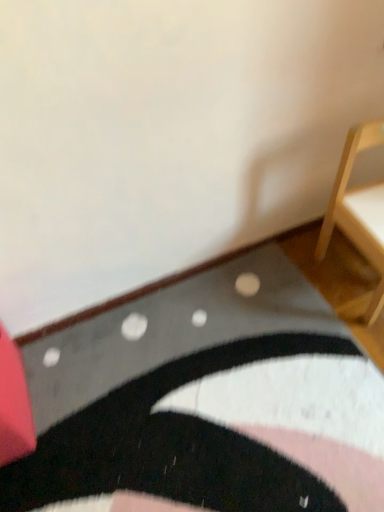
In order to face light wood chair at right, which is the 1th furniture from right to left, should I rotate leftwards or rightwards?

A 25.935 degree turn to the right will do.

The height and width of the screenshot is (512, 384). Describe the element at coordinates (14, 404) in the screenshot. I see `rubberized red cushion at lower left, which appears as the second furniture when viewed from the right` at that location.

You are a GUI agent. You are given a task and a screenshot of the screen. Output one action in this format:
    pyautogui.click(x=<x>, y=<y>)
    Task: Click on the black textured rug at lower center
    
    Given the screenshot: What is the action you would take?
    coord(206,402)

Does light wood chair at right, the 2th furniture when ordered from left to right, contain rubberized red cushion at lower left, which is counted as the first furniture, starting from the left?

Definitely not — rubberized red cushion at lower left, which is counted as the first furniture, starting from the left, is not inside light wood chair at right, the 2th furniture when ordered from left to right.

Is light wood chair at right, the 2th furniture when ordered from left to right, not near rubberized red cushion at lower left, which appears as the second furniture when viewed from the right?

They are positioned close to each other.

Is light wood chair at right, which is the 1th furniture from right to left, turned away from rubberized red cushion at lower left, which is counted as the first furniture, starting from the left?

No, rubberized red cushion at lower left, which is counted as the first furniture, starting from the left, is not at the back of light wood chair at right, which is the 1th furniture from right to left.

How far apart are light wood chair at right, which is the 1th furniture from right to left, and rubberized red cushion at lower left, which appears as the second furniture when viewed from the right?

light wood chair at right, which is the 1th furniture from right to left, is 96.89 centimeters from rubberized red cushion at lower left, which appears as the second furniture when viewed from the right.

Considering the relative sizes of rubberized red cushion at lower left, which appears as the second furniture when viewed from the right, and light wood chair at right, the 2th furniture when ordered from left to right, in the image provided, is rubberized red cushion at lower left, which appears as the second furniture when viewed from the right, bigger than light wood chair at right, the 2th furniture when ordered from left to right,?

Actually, rubberized red cushion at lower left, which appears as the second furniture when viewed from the right, might be smaller than light wood chair at right, the 2th furniture when ordered from left to right.

From the image's perspective, between rubberized red cushion at lower left, which appears as the second furniture when viewed from the right, and light wood chair at right, the 2th furniture when ordered from left to right, which one is located above?

light wood chair at right, the 2th furniture when ordered from left to right, from the image's perspective.

Would you say light wood chair at right, which is the 1th furniture from right to left, is part of rubberized red cushion at lower left, which is counted as the first furniture, starting from the left,'s contents?

No, rubberized red cushion at lower left, which is counted as the first furniture, starting from the left, does not contain light wood chair at right, which is the 1th furniture from right to left.

Can you tell me how much black textured rug at lower center and light wood chair at right, which is the 1th furniture from right to left, differ in facing direction?

89 degrees separate the facing orientations of black textured rug at lower center and light wood chair at right, which is the 1th furniture from right to left.

From a real-world perspective, is black textured rug at lower center located beneath light wood chair at right, which is the 1th furniture from right to left?

Yes, from a real-world perspective, black textured rug at lower center is below light wood chair at right, which is the 1th furniture from right to left.

Considering the positions of objects black textured rug at lower center and light wood chair at right, the 2th furniture when ordered from left to right, in the image provided, who is behind, black textured rug at lower center or light wood chair at right, the 2th furniture when ordered from left to right,?

light wood chair at right, the 2th furniture when ordered from left to right, is further away from the camera.

Consider the image. Between black textured rug at lower center and light wood chair at right, which is the 1th furniture from right to left, which one appears on the right side from the viewer's perspective?

light wood chair at right, which is the 1th furniture from right to left, is more to the right.

Considering the sizes of objects light wood chair at right, the 2th furniture when ordered from left to right, and black textured rug at lower center in the image provided, who is shorter, light wood chair at right, the 2th furniture when ordered from left to right, or black textured rug at lower center?

black textured rug at lower center.

Is light wood chair at right, the 2th furniture when ordered from left to right, positioned before black textured rug at lower center?

That is False.

Which of these two, light wood chair at right, the 2th furniture when ordered from left to right, or black textured rug at lower center, is thinner?

light wood chair at right, the 2th furniture when ordered from left to right.

From the image's perspective, is light wood chair at right, the 2th furniture when ordered from left to right, positioned above or below black textured rug at lower center?

light wood chair at right, the 2th furniture when ordered from left to right, is above black textured rug at lower center.

Image resolution: width=384 pixels, height=512 pixels. I want to click on the 1st furniture directly above the black textured rug at lower center (from a real-world perspective), so click(x=14, y=404).

From the image's perspective, is rubberized red cushion at lower left, which appears as the second furniture when viewed from the right, above black textured rug at lower center?

Correct, rubberized red cushion at lower left, which appears as the second furniture when viewed from the right, appears higher than black textured rug at lower center in the image.

Considering the positions of objects rubberized red cushion at lower left, which appears as the second furniture when viewed from the right, and black textured rug at lower center in the image provided, who is more to the left, rubberized red cushion at lower left, which appears as the second furniture when viewed from the right, or black textured rug at lower center?

Positioned to the left is rubberized red cushion at lower left, which appears as the second furniture when viewed from the right.

Considering the positions of objects black textured rug at lower center and rubberized red cushion at lower left, which is counted as the first furniture, starting from the left, in the image provided, who is more to the left, black textured rug at lower center or rubberized red cushion at lower left, which is counted as the first furniture, starting from the left,?

rubberized red cushion at lower left, which is counted as the first furniture, starting from the left.

Can you confirm if black textured rug at lower center is thinner than rubberized red cushion at lower left, which appears as the second furniture when viewed from the right?

In fact, black textured rug at lower center might be wider than rubberized red cushion at lower left, which appears as the second furniture when viewed from the right.

In the image, there is a rubberized red cushion at lower left, which appears as the second furniture when viewed from the right. Where is `mat below it (from a real-world perspective)`? Image resolution: width=384 pixels, height=512 pixels. mat below it (from a real-world perspective) is located at coordinates [x=206, y=402].

Who is bigger, black textured rug at lower center or rubberized red cushion at lower left, which is counted as the first furniture, starting from the left?

With larger size is black textured rug at lower center.

What are the coordinates of `furniture below the light wood chair at right, which is the 1th furniture from right to left (from a real-world perspective)` in the screenshot? It's located at (14, 404).

The height and width of the screenshot is (512, 384). I want to click on furniture above the rubberized red cushion at lower left, which appears as the second furniture when viewed from the right (from the image's perspective), so click(x=358, y=211).

Looking at the image, which one is located closer to light wood chair at right, the 2th furniture when ordered from left to right, black textured rug at lower center or rubberized red cushion at lower left, which appears as the second furniture when viewed from the right?

black textured rug at lower center.

From the image, which object appears to be farther from light wood chair at right, which is the 1th furniture from right to left, rubberized red cushion at lower left, which is counted as the first furniture, starting from the left, or black textured rug at lower center?

Based on the image, rubberized red cushion at lower left, which is counted as the first furniture, starting from the left, appears to be further to light wood chair at right, which is the 1th furniture from right to left.

Looking at the image, which one is located closer to rubberized red cushion at lower left, which appears as the second furniture when viewed from the right, black textured rug at lower center or light wood chair at right, which is the 1th furniture from right to left?

Answer: The object closer to rubberized red cushion at lower left, which appears as the second furniture when viewed from the right, is black textured rug at lower center.

Based on their spatial positions, is light wood chair at right, the 2th furniture when ordered from left to right, or black textured rug at lower center closer to rubberized red cushion at lower left, which appears as the second furniture when viewed from the right?

Based on the image, black textured rug at lower center appears to be nearer to rubberized red cushion at lower left, which appears as the second furniture when viewed from the right.

Estimate the real-world distances between objects in this image. Which object is further from black textured rug at lower center, rubberized red cushion at lower left, which is counted as the first furniture, starting from the left, or light wood chair at right, the 2th furniture when ordered from left to right?

light wood chair at right, the 2th furniture when ordered from left to right, is positioned further to the anchor black textured rug at lower center.

From the image, which object appears to be nearer to black textured rug at lower center, light wood chair at right, which is the 1th furniture from right to left, or rubberized red cushion at lower left, which is counted as the first furniture, starting from the left?

rubberized red cushion at lower left, which is counted as the first furniture, starting from the left, is closer to black textured rug at lower center.

Where is `mat located between rubberized red cushion at lower left, which appears as the second furniture when viewed from the right, and light wood chair at right, which is the 1th furniture from right to left, in the left-right direction`? The height and width of the screenshot is (512, 384). mat located between rubberized red cushion at lower left, which appears as the second furniture when viewed from the right, and light wood chair at right, which is the 1th furniture from right to left, in the left-right direction is located at coordinates (206, 402).